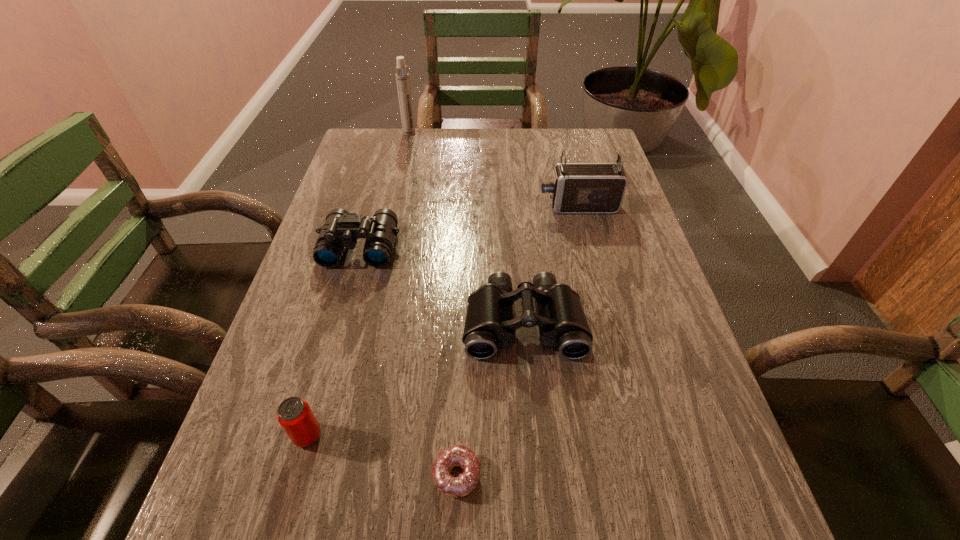
Locate an element on the screen. Image resolution: width=960 pixels, height=540 pixels. empty space between the left binoculars and the nearest object is located at coordinates (408, 361).

The image size is (960, 540). In order to click on vacant area that lies between the fifth farthest object and the left binoculars in this screenshot , I will do `click(334, 341)`.

Locate an element on the screen. This screenshot has width=960, height=540. vacant space in between the nearer binoculars and the can is located at coordinates (416, 379).

Where is `free area in between the left binoculars and the nearer binoculars`? free area in between the left binoculars and the nearer binoculars is located at coordinates pyautogui.click(x=442, y=285).

Identify the location of free space between the nearest object and the fourth farthest object. This screenshot has width=960, height=540. pos(491,399).

You are a GUI agent. You are given a task and a screenshot of the screen. Output one action in this format:
    pyautogui.click(x=<x>, y=<y>)
    Task: Click on the empty space that is in between the farthest object and the right binoculars
    
    Given the screenshot: What is the action you would take?
    pyautogui.click(x=467, y=228)

Image resolution: width=960 pixels, height=540 pixels. What are the coordinates of `vacant space that is in between the aerosol can and the can` in the screenshot? It's located at (358, 284).

Where is `blank region between the farther binoculars and the second farthest object`? Image resolution: width=960 pixels, height=540 pixels. blank region between the farther binoculars and the second farthest object is located at coordinates (469, 227).

Image resolution: width=960 pixels, height=540 pixels. I want to click on free space between the nearer binoculars and the nearest object, so click(491, 399).

Locate an element on the screen. free space between the fifth shortest object and the farther binoculars is located at coordinates (469, 227).